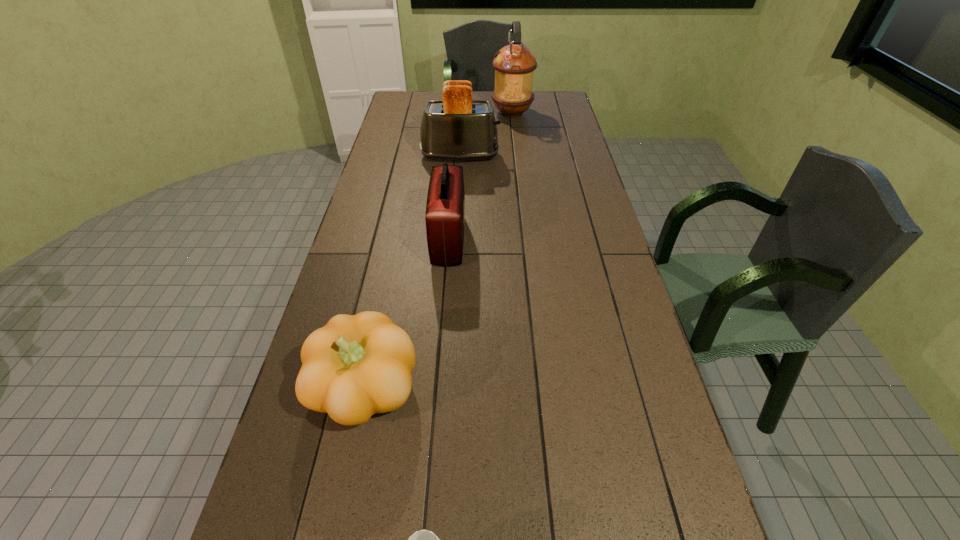
You are a GUI agent. You are given a task and a screenshot of the screen. Output one action in this format:
    pyautogui.click(x=<x>, y=<y>)
    Task: Click on the free space between the second shortest object and the third farthest object
    The height and width of the screenshot is (540, 960).
    Given the screenshot: What is the action you would take?
    pyautogui.click(x=407, y=315)

Locate an element on the screen. free space between the first aid kit and the oil lamp is located at coordinates (480, 177).

In order to click on object that is the closest to the toaster in this screenshot , I will do `click(514, 64)`.

Identify which object is the second nearest to the glass. Please provide its 2D coordinates. Your answer should be formatted as a tuple, i.e. [(x, y)], where the tuple contains the x and y coordinates of a point satisfying the conditions above.

[(445, 209)]